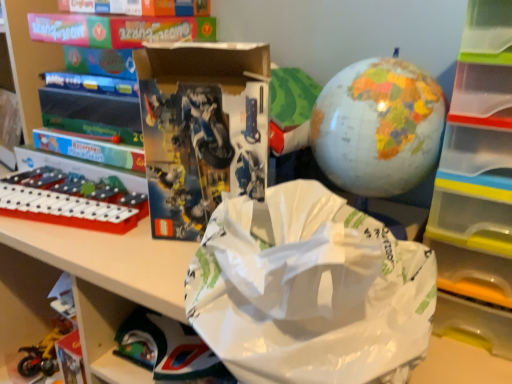
Locate an element on the screen. The height and width of the screenshot is (384, 512). transparent plastic drawer at right is located at coordinates (477, 184).

The width and height of the screenshot is (512, 384). Describe the element at coordinates (378, 127) in the screenshot. I see `matte plastic globe at upper right, the 1th toy in the front-to-back sequence` at that location.

Image resolution: width=512 pixels, height=384 pixels. What do you see at coordinates (202, 129) in the screenshot?
I see `matte black lego set at center` at bounding box center [202, 129].

The image size is (512, 384). What do you see at coordinates (70, 201) in the screenshot?
I see `white plastic tray at left, which is the second toy in top-to-bottom order` at bounding box center [70, 201].

How much space does metallic yellow motorcycle at lower left, the 1th toy when ordered from back to front, occupy vertically?

2.81 inches.

Locate an element on the screen. The image size is (512, 384). metallic yellow motorcycle at lower left, the third toy in the top-to-bottom sequence is located at coordinates (44, 352).

In order to click on transparent plastic drawer at right in this screenshot , I will do `click(477, 184)`.

What's the angular difference between matte black lego set at center and metallic yellow motorcycle at lower left, the 3th toy in the right-to-left sequence,'s facing directions?

They differ by 29.3 degrees in their facing directions.

Between matte black lego set at center and metallic yellow motorcycle at lower left, acting as the 1th toy starting from the left, which one has less height?

metallic yellow motorcycle at lower left, acting as the 1th toy starting from the left, is shorter.

Which is behind, matte black lego set at center or metallic yellow motorcycle at lower left, which is the 1th toy from bottom to top?

metallic yellow motorcycle at lower left, which is the 1th toy from bottom to top, is more distant.

Is matte black lego set at center oriented towards metallic yellow motorcycle at lower left, which is the 1th toy from bottom to top?

No, matte black lego set at center does not turn towards metallic yellow motorcycle at lower left, which is the 1th toy from bottom to top.

Is matte black lego set at center facing away from matte plastic globe at upper right, acting as the 1th toy starting from the right?

That's not correct — matte black lego set at center is not looking away from matte plastic globe at upper right, acting as the 1th toy starting from the right.

From the image's perspective, which one is positioned lower, matte black lego set at center or matte plastic globe at upper right, the 1th toy in the front-to-back sequence?

matte black lego set at center is shown below in the image.

Does matte black lego set at center appear on the left side of matte plastic globe at upper right, which is the third toy from bottom to top?

Answer: Correct, you'll find matte black lego set at center to the left of matte plastic globe at upper right, which is the third toy from bottom to top.

Which object is more forward, matte black lego set at center or matte plastic globe at upper right, the 3th toy viewed from the back?

matte plastic globe at upper right, the 3th toy viewed from the back.

How many degrees apart are the facing directions of white plastic tray at left, which is the 2th toy from right to left, and metallic yellow motorcycle at lower left, the third toy in the top-to-bottom sequence?

They differ by 17.4 degrees in their facing directions.

This screenshot has height=384, width=512. Identify the location of the 1st toy in front when counting from the metallic yellow motorcycle at lower left, the 1th toy when ordered from back to front. (70, 201).

Does white plastic tray at left, the second toy in the front-to-back sequence, have a lesser width compared to metallic yellow motorcycle at lower left, the 1th toy when ordered from back to front?

In fact, white plastic tray at left, the second toy in the front-to-back sequence, might be wider than metallic yellow motorcycle at lower left, the 1th toy when ordered from back to front.

Is point (37, 360) positioned behind point (212, 158)?

Yes, it is.

Does metallic yellow motorcycle at lower left, arranged as the third toy when viewed from the front, have a smaller size compared to matte black lego set at center?

Yes.

Is the depth of metallic yellow motorcycle at lower left, arranged as the third toy when viewed from the front, less than that of matte black lego set at center?

No, metallic yellow motorcycle at lower left, arranged as the third toy when viewed from the front, is further to the viewer.

Is matte black lego set at center surrounded by metallic yellow motorcycle at lower left, acting as the 1th toy starting from the left?

No.

Would you consider matte plastic globe at upper right, marked as the 3th toy in a left-to-right arrangement, to be distant from transparent plastic drawer at right?

matte plastic globe at upper right, marked as the 3th toy in a left-to-right arrangement, is actually quite close to transparent plastic drawer at right.

From the picture: Considering the sizes of objects matte plastic globe at upper right, the 1th toy in the front-to-back sequence, and transparent plastic drawer at right in the image provided, who is smaller, matte plastic globe at upper right, the 1th toy in the front-to-back sequence, or transparent plastic drawer at right?

matte plastic globe at upper right, the 1th toy in the front-to-back sequence.

Which object is positioned more to the left, matte plastic globe at upper right, marked as the 3th toy in a left-to-right arrangement, or transparent plastic drawer at right?

Positioned to the left is matte plastic globe at upper right, marked as the 3th toy in a left-to-right arrangement.

Considering the positions of objects matte plastic globe at upper right, which is the third toy from bottom to top, and transparent plastic drawer at right in the image provided, who is in front, matte plastic globe at upper right, which is the third toy from bottom to top, or transparent plastic drawer at right?

transparent plastic drawer at right is more forward.

Can you tell me how much transparent plastic drawer at right and white paper grocery bag at center differ in facing direction?

transparent plastic drawer at right and white paper grocery bag at center are facing 1.01 degrees away from each other.

Is point (482, 218) farther from viewer compared to point (309, 202)?

Yes, it is behind point (309, 202).

Could you tell me if transparent plastic drawer at right is facing white paper grocery bag at center?

No, transparent plastic drawer at right is not oriented towards white paper grocery bag at center.

Is transparent plastic drawer at right to the right of white paper grocery bag at center from the viewer's perspective?

Correct, you'll find transparent plastic drawer at right to the right of white paper grocery bag at center.

From a real-world perspective, who is located higher, transparent plastic drawer at right or white plastic tray at left, marked as the 2th toy in a left-to-right arrangement?

From a 3D spatial view, transparent plastic drawer at right is above.

Is the position of transparent plastic drawer at right less distant than that of white plastic tray at left, which ranks as the 2th toy in back-to-front order?

Yes, it is in front of white plastic tray at left, which ranks as the 2th toy in back-to-front order.

From the image's perspective, would you say transparent plastic drawer at right is shown under white plastic tray at left, marked as the 2th toy in a left-to-right arrangement?

No, from the image's perspective, transparent plastic drawer at right is not beneath white plastic tray at left, marked as the 2th toy in a left-to-right arrangement.

Find the location of `the 2nd toy to the left of the matte black lego set at center, starting your count from the anchor`. the 2nd toy to the left of the matte black lego set at center, starting your count from the anchor is located at coordinates (44, 352).

Find the location of a particular element. This screenshot has height=384, width=512. toy in front of the matte black lego set at center is located at coordinates (378, 127).

Based on their spatial positions, is transparent plastic drawer at right or white plastic tray at left, the second toy in the front-to-back sequence, further from white paper grocery bag at center?

white plastic tray at left, the second toy in the front-to-back sequence, is further to white paper grocery bag at center.

Looking at the image, which one is located closer to white plastic tray at left, which ranks as the 2th toy in back-to-front order, transparent plastic drawer at right or metallic yellow motorcycle at lower left, the third toy in the top-to-bottom sequence?

The object closer to white plastic tray at left, which ranks as the 2th toy in back-to-front order, is metallic yellow motorcycle at lower left, the third toy in the top-to-bottom sequence.

Looking at the image, which one is located further to white paper grocery bag at center, transparent plastic drawer at right or matte black lego set at center?

transparent plastic drawer at right lies further to white paper grocery bag at center than the other object.

Which object lies nearer to the anchor point matte plastic globe at upper right, which is the third toy from bottom to top, metallic yellow motorcycle at lower left, the 3th toy in the right-to-left sequence, or white plastic tray at left, which ranks as the 2th toy in back-to-front order?

Based on the image, white plastic tray at left, which ranks as the 2th toy in back-to-front order, appears to be nearer to matte plastic globe at upper right, which is the third toy from bottom to top.

From the image, which object appears to be nearer to transparent plastic drawer at right, matte plastic globe at upper right, the 1th toy in the front-to-back sequence, or metallic yellow motorcycle at lower left, arranged as the third toy when viewed from the front?

matte plastic globe at upper right, the 1th toy in the front-to-back sequence.

Which object lies nearer to the anchor point transparent plastic drawer at right, matte plastic globe at upper right, acting as the 1th toy starting from the right, or matte black lego set at center?

matte plastic globe at upper right, acting as the 1th toy starting from the right.

Looking at the image, which one is located closer to matte plastic globe at upper right, the 1th toy in the front-to-back sequence, white plastic tray at left, the second toy in the front-to-back sequence, or metallic yellow motorcycle at lower left, acting as the 1th toy starting from the left?

The object closer to matte plastic globe at upper right, the 1th toy in the front-to-back sequence, is white plastic tray at left, the second toy in the front-to-back sequence.

From the image, which object appears to be nearer to transparent plastic drawer at right, matte black lego set at center or matte plastic globe at upper right, the 1th toy in the front-to-back sequence?

matte plastic globe at upper right, the 1th toy in the front-to-back sequence, is closer to transparent plastic drawer at right.

What are the coordinates of `book between white plastic tray at left, acting as the second toy starting from the bottom, and matte plastic globe at upper right, which is the third toy from bottom to top, from left to right` in the screenshot? It's located at (202, 129).

Where is `grocery bag located between metallic yellow motorcycle at lower left, the third toy in the top-to-bottom sequence, and matte plastic globe at upper right, the 1th toy in the front-to-back sequence, in the left-right direction`? The width and height of the screenshot is (512, 384). grocery bag located between metallic yellow motorcycle at lower left, the third toy in the top-to-bottom sequence, and matte plastic globe at upper right, the 1th toy in the front-to-back sequence, in the left-right direction is located at coordinates (310, 291).

The width and height of the screenshot is (512, 384). In order to click on toy between white plastic tray at left, the second toy in the front-to-back sequence, and transparent plastic drawer at right in this screenshot , I will do `click(378, 127)`.

I want to click on grocery bag situated between white plastic tray at left, marked as the 2th toy in a left-to-right arrangement, and matte plastic globe at upper right, which ranks as the 1th toy in top-to-bottom order, from left to right, so click(310, 291).